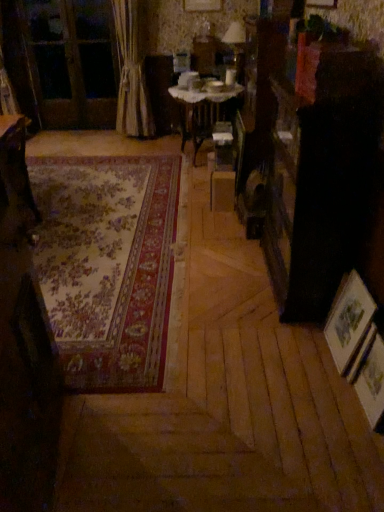
This screenshot has width=384, height=512. In order to click on vacant region in front of wooden picture frame at lower right, marked as the second picture frame in a back-to-front arrangement in this screenshot , I will do `click(366, 440)`.